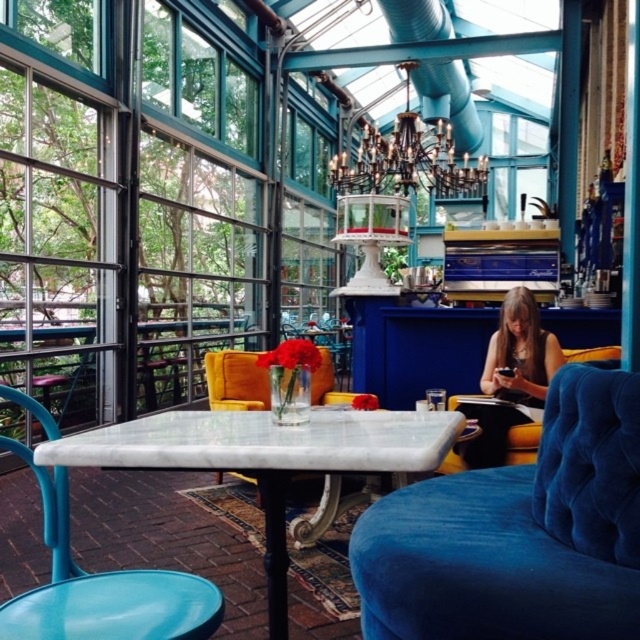
Is white marble table at center bigger than velvet yellow armchair at center?

Correct, white marble table at center is larger in size than velvet yellow armchair at center.

Between white marble table at center and velvet yellow armchair at center, which one has more height?

Standing taller between the two is white marble table at center.

This screenshot has width=640, height=640. What do you see at coordinates (264, 458) in the screenshot? I see `white marble table at center` at bounding box center [264, 458].

Image resolution: width=640 pixels, height=640 pixels. What are the coordinates of `white marble table at center` in the screenshot? It's located at (264, 458).

Is smooth brown hair at right to the right of velvet blue armchair at center from the viewer's perspective?

In fact, smooth brown hair at right is to the left of velvet blue armchair at center.

Does smooth brown hair at right have a lesser height compared to velvet blue armchair at center?

No, smooth brown hair at right is not shorter than velvet blue armchair at center.

You are a GUI agent. You are given a task and a screenshot of the screen. Output one action in this format:
    pyautogui.click(x=<x>, y=<y>)
    Task: Click on the smooth brown hair at right
    The height and width of the screenshot is (640, 640).
    Given the screenshot: What is the action you would take?
    pyautogui.click(x=518, y=353)

Image resolution: width=640 pixels, height=640 pixels. Find the location of `smooth brown hair at right`. smooth brown hair at right is located at coordinates (518, 353).

Does white marble table at center lie in front of smooth brown hair at right?

Yes, white marble table at center is in front of smooth brown hair at right.

Can you confirm if white marble table at center is positioned above smooth brown hair at right?

Incorrect, white marble table at center is not positioned above smooth brown hair at right.

Locate an element on the screen. white marble table at center is located at coordinates (264, 458).